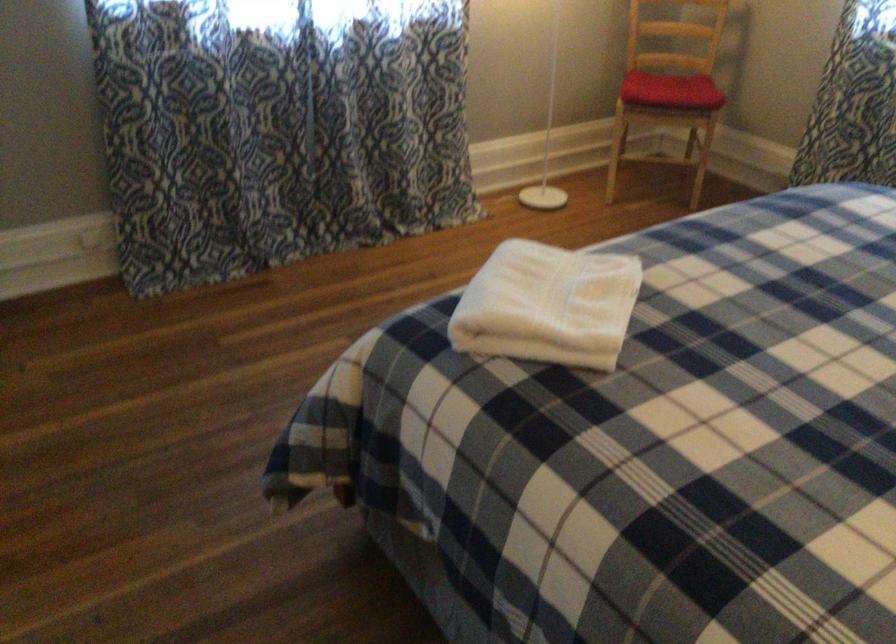
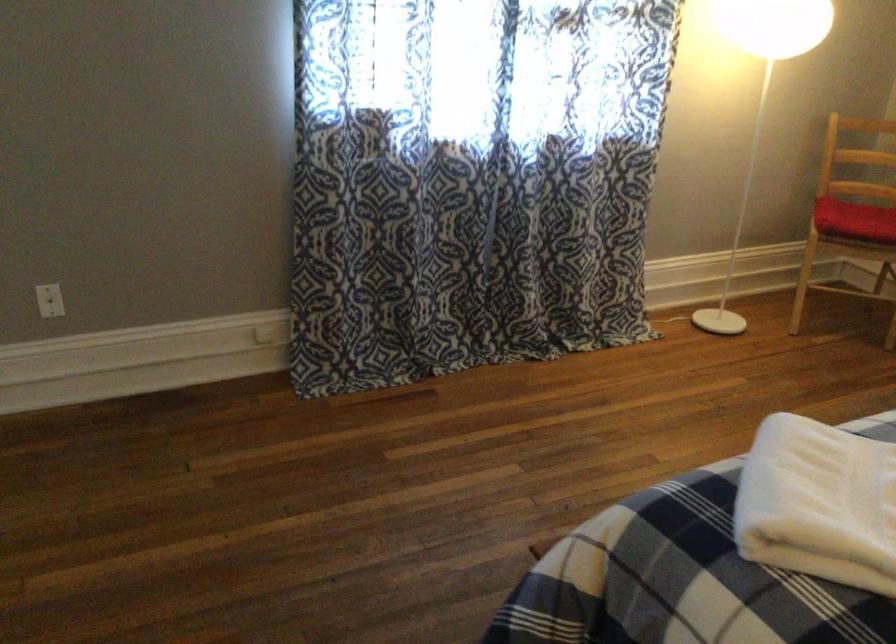
The images are taken continuously from a first-person perspective. In which direction are you moving?

The cameraman walked toward left, forward.